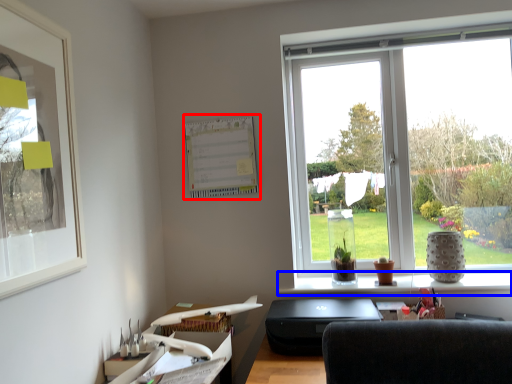
Question: Which object appears farthest to the camera in this image, bulletin board (highlighted by a red box) or window sill (highlighted by a blue box)?

Choices:
 (A) bulletin board
 (B) window sill

Answer: (A)